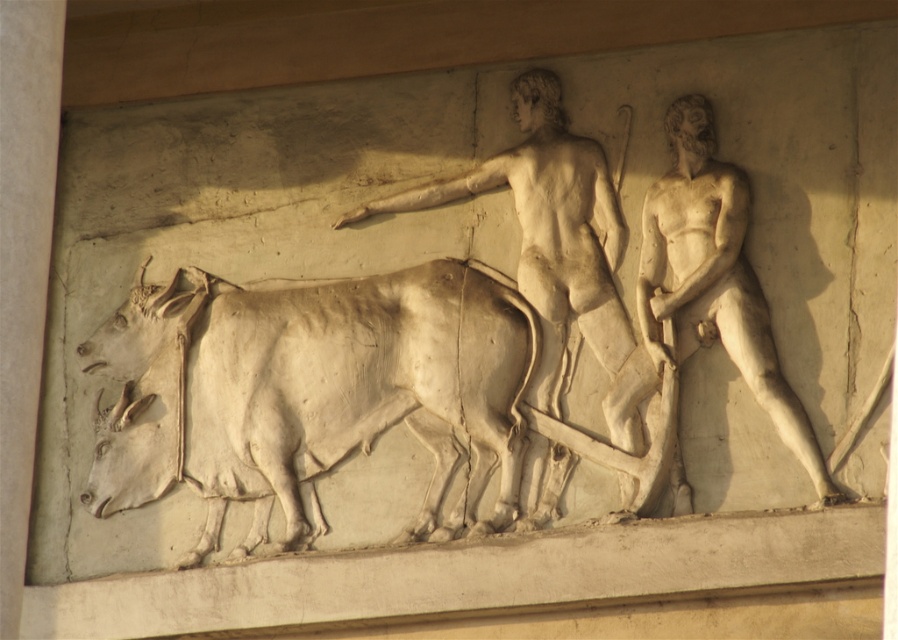
Question: Estimate the real-world distances between objects in this image. Which object is farther from the white marble man at center?

Choices:
 (A) white marble man at right
 (B) white stone cow at center

Answer: (B)

Question: Among these objects, which one is nearest to the camera?

Choices:
 (A) white marble man at right
 (B) white stone cow at center
 (C) white marble man at center

Answer: (A)

Question: Is white stone cow at center bigger than white marble man at center?

Choices:
 (A) yes
 (B) no

Answer: (B)

Question: In this image, where is white marble man at center located relative to white marble man at right?

Choices:
 (A) left
 (B) right

Answer: (A)

Question: Which point appears farthest from the camera in this image?

Choices:
 (A) (106, 349)
 (B) (712, 172)
 (C) (577, 435)

Answer: (A)

Question: Considering the relative positions of white stone cow at center and white marble man at center in the image provided, where is white stone cow at center located with respect to white marble man at center?

Choices:
 (A) right
 (B) left

Answer: (B)